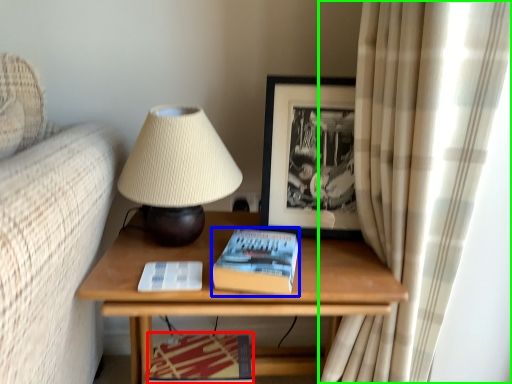
Question: Considering the real-world distances, which object is closest to magazine (highlighted by a red box)? paperback book (highlighted by a blue box) or curtain (highlighted by a green box).

Choices:
 (A) paperback book
 (B) curtain

Answer: (A)